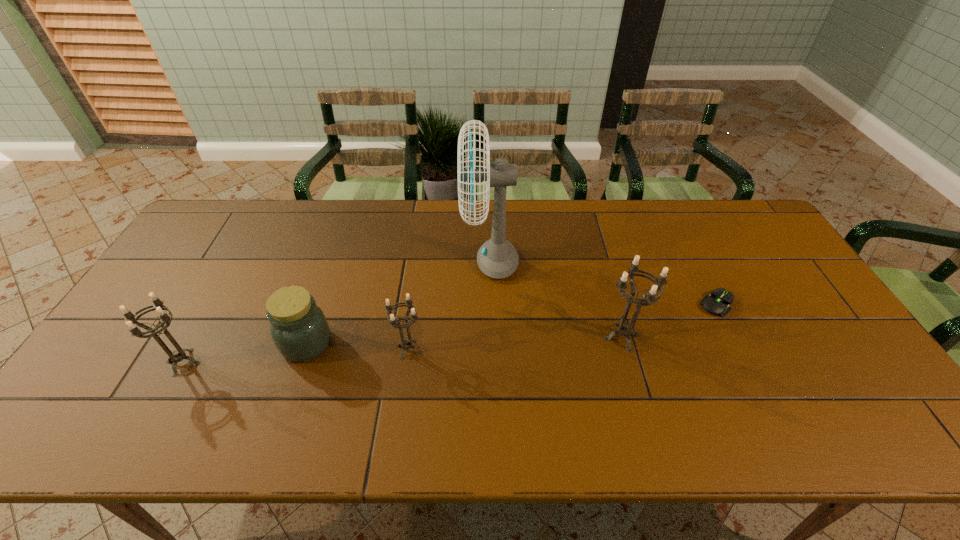
Find the location of a particular element. empty space between the tallest object and the computer mouse is located at coordinates (604, 282).

You are a GUI agent. You are given a task and a screenshot of the screen. Output one action in this format:
    pyautogui.click(x=<x>, y=<y>)
    Task: Click on the vacant point located between the jar and the shortest candle holder
    
    Given the screenshot: What is the action you would take?
    pyautogui.click(x=357, y=347)

Locate an element on the screen. The height and width of the screenshot is (540, 960). blank region between the jar and the fourth object from right to left is located at coordinates (357, 347).

You are a GUI agent. You are given a task and a screenshot of the screen. Output one action in this format:
    pyautogui.click(x=<x>, y=<y>)
    Task: Click on the free space between the fifth object from right to left and the rightmost candle holder
    The width and height of the screenshot is (960, 540).
    Given the screenshot: What is the action you would take?
    pyautogui.click(x=465, y=340)

Where is `free space between the leftmost object and the jar`? The image size is (960, 540). free space between the leftmost object and the jar is located at coordinates (245, 353).

At what (x,y) coordinates should I click in order to perform the action: click on unoccupied position between the shortest object and the third tallest object. Please return your answer as a coordinate pair (x, y). Looking at the image, I should click on (450, 333).

Find the location of a particular element. The image size is (960, 540). empty space between the leftmost object and the fourth object from left to right is located at coordinates (337, 312).

Identify the location of vacant area that lies between the second candle holder from right to left and the jar. (357, 347).

The width and height of the screenshot is (960, 540). In order to click on object that is the closest to the shortest object in this screenshot , I will do `click(625, 329)`.

Where is `the fourth closest object to the rightmost candle holder`? the fourth closest object to the rightmost candle holder is located at coordinates (299, 329).